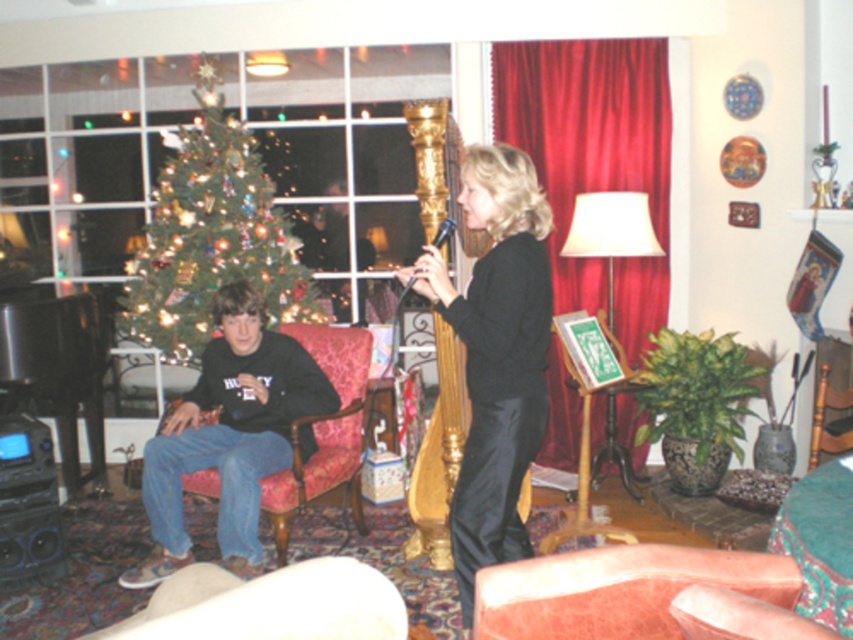
You are a guest at this holiday gathering and need to place your coat on a piece of furniture. Which object, the matte black hautboy at left or the wooden armchair at lower right, is a suitable place to put your coat?

The wooden armchair at lower right is a suitable place to put your coat because the matte black hautboy at left is located below it and likely an instrument, not furniture.

You are a photographer setting up for a photoshoot in this room. You need to place a spotlight on the black satin dress at center and another on the velvet pink armchair at lower center. According to the scene description, which object is positioned to the left of the other?

The black satin dress at center is to the left of the velvet pink armchair at lower center.

From the picture: You are a musician who wants to place a new instrument case on the floor near the point marked at coordinates (229,435). What instrument is located at that point?

The point at coordinates (229,435) indicates a matte black hautboy at left.